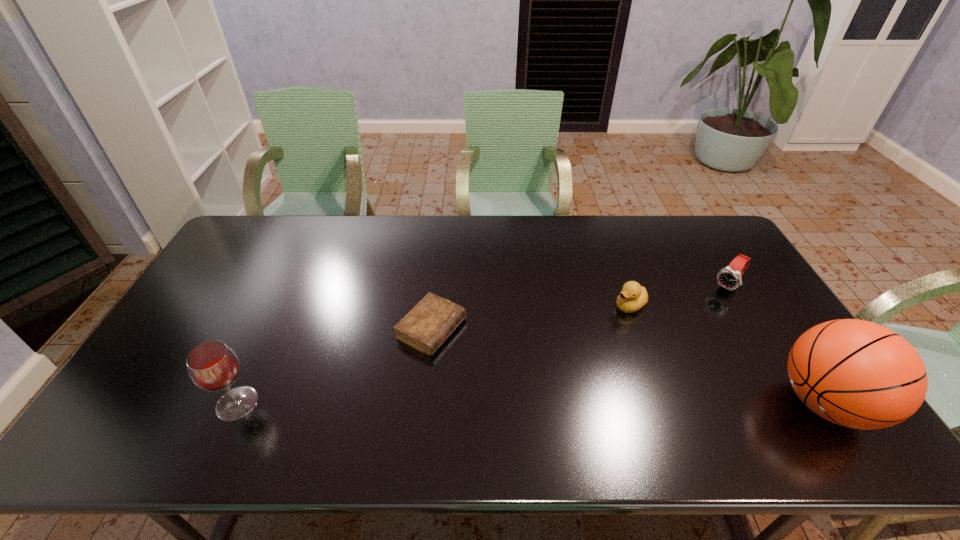
Locate an element on the screen. object identified as the second closest to the shortest object is located at coordinates (633, 296).

Where is `free space that satisfies the following two spatial constraints: 1. on the front side of the basketball; 2. on the left side of the shortest object`? The height and width of the screenshot is (540, 960). free space that satisfies the following two spatial constraints: 1. on the front side of the basketball; 2. on the left side of the shortest object is located at coordinates (423, 403).